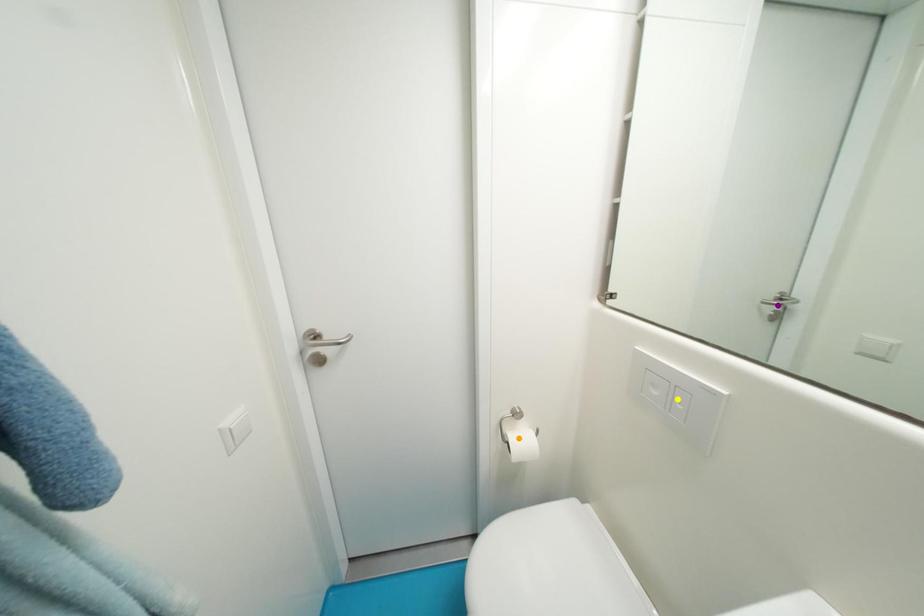
Order these from farthest to nearest:
A) purple point
B) yellow point
C) orange point

purple point, orange point, yellow point